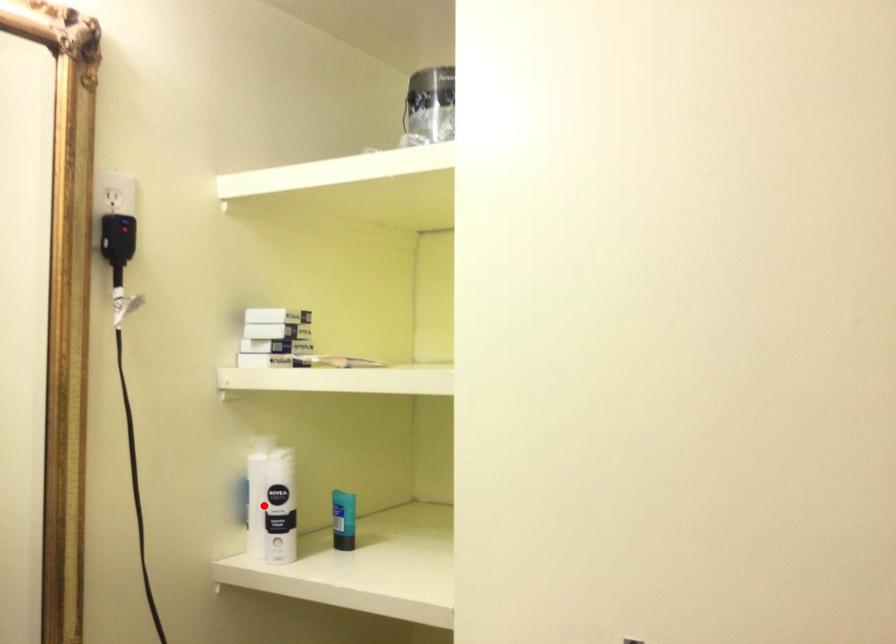
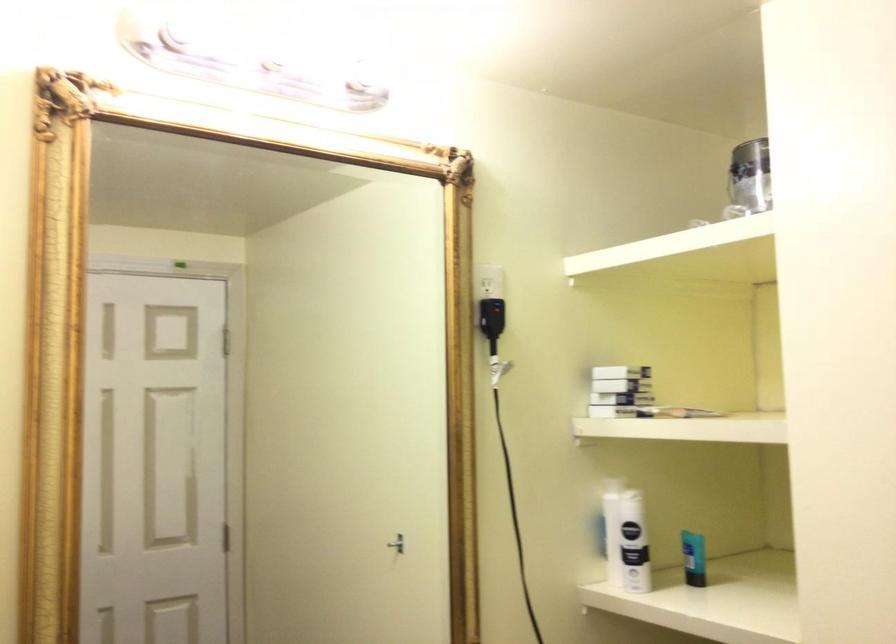
In the second image, find the point that corresponds to the highlighted location in the first image.

(625, 538)